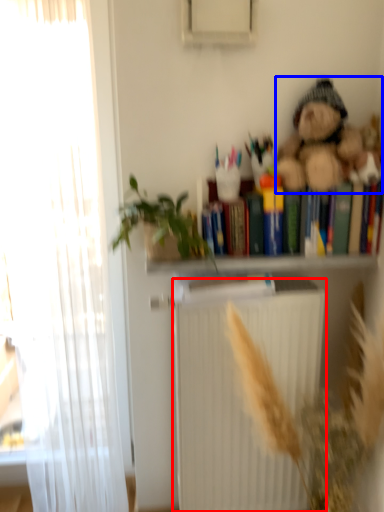
Question: Which point is closer to the camera, radiator (highlighted by a red box) or teddy bear (highlighted by a blue box)?

Choices:
 (A) radiator
 (B) teddy bear

Answer: (B)